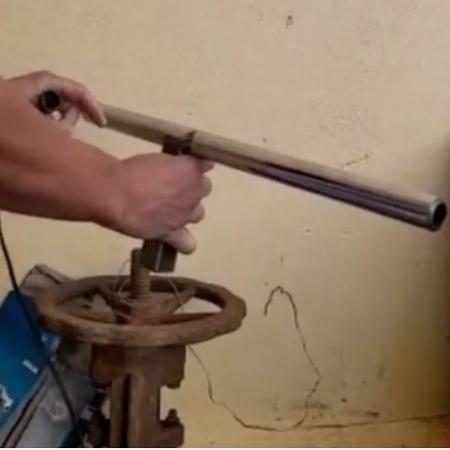
The width and height of the screenshot is (450, 450). What are the coordinates of `scuff on wall` in the screenshot? It's located at (294, 13).